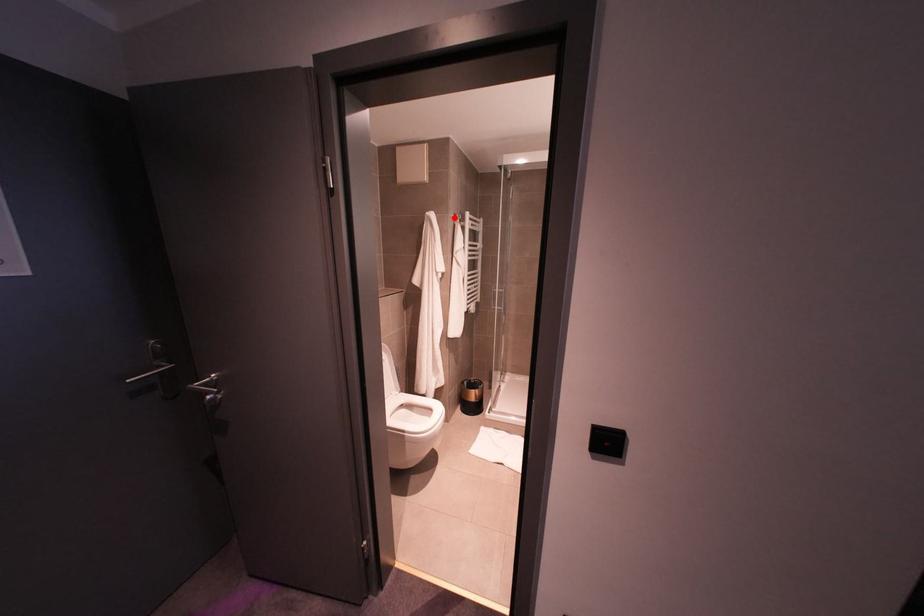
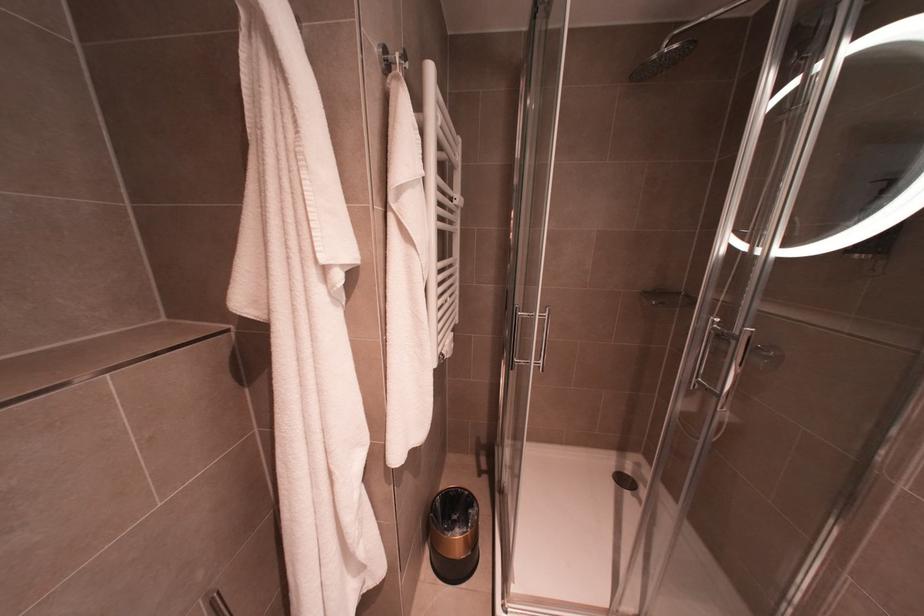
In the second image, find the point that corresponds to the highlighted location in the first image.

(386, 66)